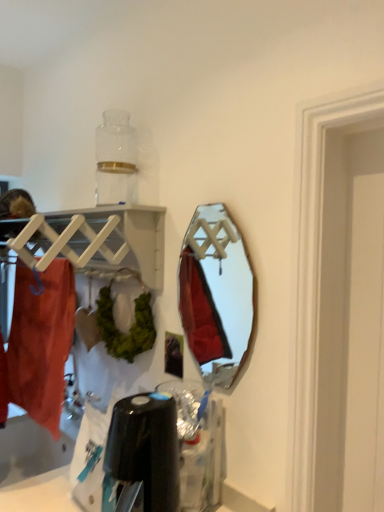
Question: Looking at their shapes, would you say matte orange towel at left is wider or thinner than white matte wooden shelf at upper left?

Choices:
 (A) wide
 (B) thin

Answer: (B)

Question: In terms of height, does matte orange towel at left look taller or shorter compared to white matte wooden shelf at upper left?

Choices:
 (A) short
 (B) tall

Answer: (B)

Question: Based on their relative distances, which object is farther from the white matte wooden shelf at upper left?

Choices:
 (A) metallic silver mirror at center
 (B) matte orange towel at left

Answer: (A)

Question: Estimate the real-world distances between objects in this image. Which object is closer to the white matte wooden shelf at upper left?

Choices:
 (A) matte orange towel at left
 (B) metallic silver mirror at center

Answer: (A)